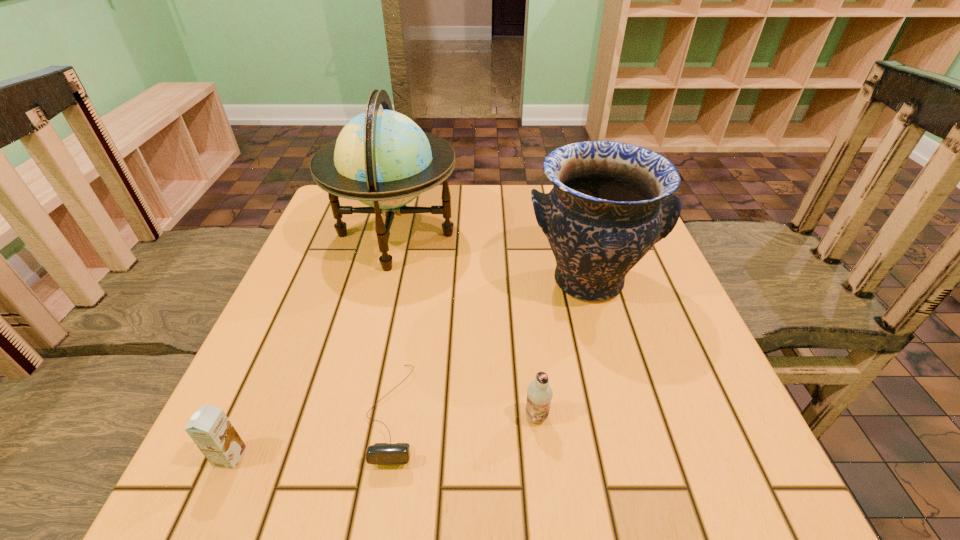
In the image, there is a desktop. In order to click on vacant space at the right edge in this screenshot , I will do `click(660, 428)`.

This screenshot has width=960, height=540. Find the location of `vacant space at the far left corner of the desktop`. vacant space at the far left corner of the desktop is located at coordinates (327, 214).

Locate an element on the screen. free point between the fourth shortest object and the globe is located at coordinates (492, 258).

Where is `free point between the left chocolate milk and the tallest object`? This screenshot has height=540, width=960. free point between the left chocolate milk and the tallest object is located at coordinates (313, 346).

At what (x,y) coordinates should I click in order to perform the action: click on unoccupied area between the nearer chocolate milk and the tallest object. Please return your answer as a coordinate pair (x, y). Image resolution: width=960 pixels, height=540 pixels. Looking at the image, I should click on (313, 346).

What are the coordinates of `blank region between the pottery and the webcam` in the screenshot? It's located at (491, 347).

Find the location of a particular element. This screenshot has height=540, width=960. vacant area between the fourth shortest object and the farther chocolate milk is located at coordinates (562, 349).

Locate an element on the screen. Image resolution: width=960 pixels, height=540 pixels. vacant space that is in between the globe and the second tallest object is located at coordinates (492, 258).

This screenshot has height=540, width=960. I want to click on vacant space in between the webcam and the second tallest object, so click(x=491, y=347).

This screenshot has width=960, height=540. I want to click on free space between the globe and the right chocolate milk, so tap(466, 326).